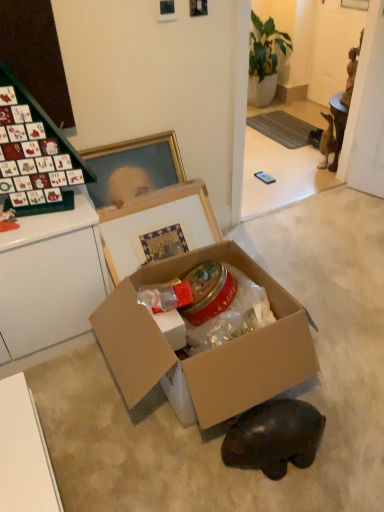
Question: Looking at their shapes, would you say brown matte figurine at right, which is the 2th animal from left to right, is wider or thinner than green glossy plant at upper center?

Choices:
 (A) wide
 (B) thin

Answer: (B)

Question: Which is correct: brown matte figurine at right, which is the 2th animal from left to right, is inside green glossy plant at upper center, or outside of it?

Choices:
 (A) inside
 (B) outside

Answer: (B)

Question: Which object is the closest to the cardboard box at center?

Choices:
 (A) shiny black bear at lower center, which is the second animal from top to bottom
 (B) cardboard box at center
 (C) green glossy plant at upper center
 (D) brown matte figurine at right, the 2th animal positioned from the bottom

Answer: (B)

Question: Which is nearer to the brown matte figurine at right, which is the first animal from right to left?

Choices:
 (A) shiny black bear at lower center, the first animal from the front
 (B) cardboard box at center
 (C) green glossy plant at upper center
 (D) cardboard box at center

Answer: (C)